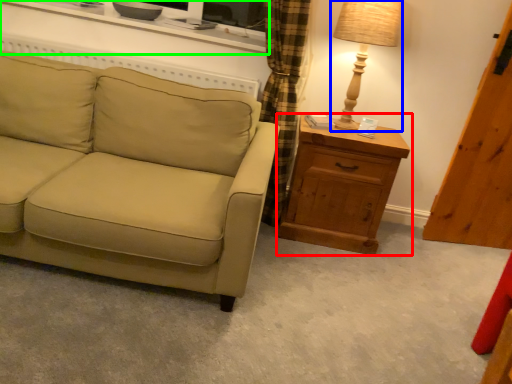
Question: Considering the real-world distances, which object is closest to chest of drawers (highlighted by a red box)? table lamp (highlighted by a blue box) or entertainment center (highlighted by a green box).

Choices:
 (A) table lamp
 (B) entertainment center

Answer: (A)